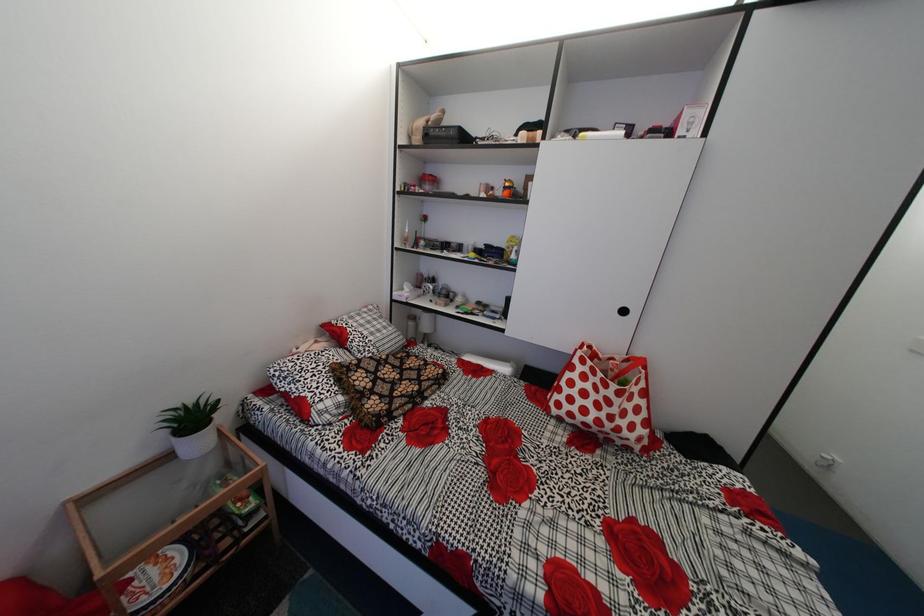
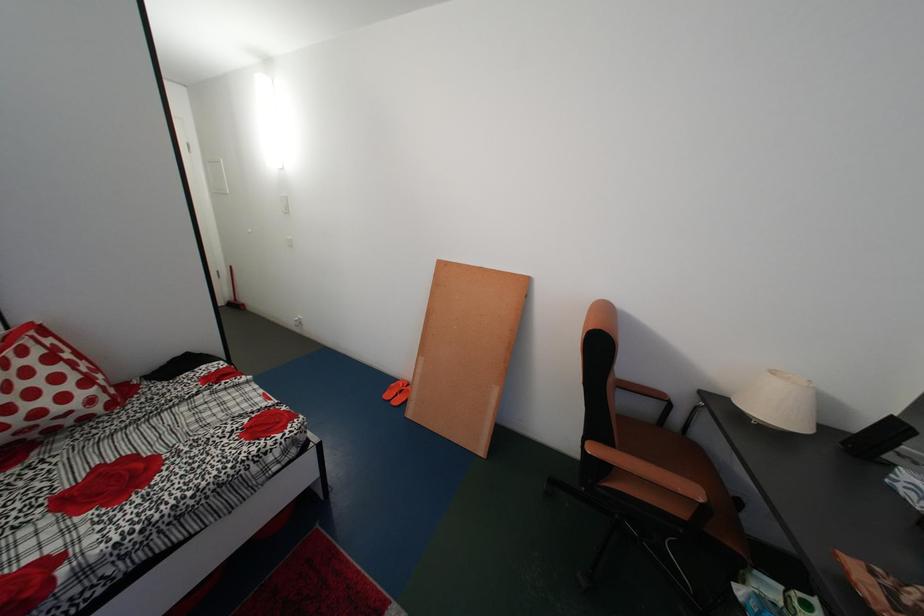
Consider the image. The images are taken continuously from a first-person perspective. In which direction is your viewpoint rotating?

The camera rotated toward right-down.